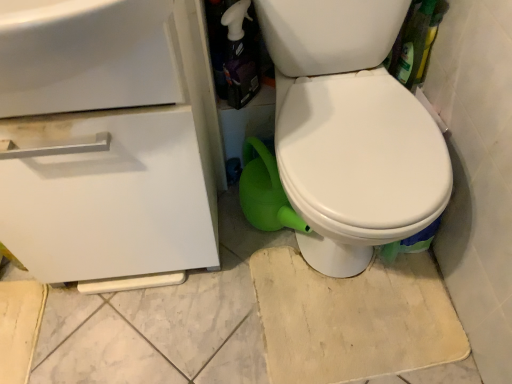
In order to click on white matte drawer at left in this screenshot , I will do `click(109, 194)`.

What do you see at coordinates (85, 56) in the screenshot? This screenshot has height=384, width=512. I see `white glossy sink at upper left` at bounding box center [85, 56].

Find the location of a particular element. The height and width of the screenshot is (384, 512). white glossy spray bottle at upper center is located at coordinates (240, 56).

Is white matte drawer at left located outside white glossy spray bottle at upper center?

white matte drawer at left lies outside white glossy spray bottle at upper center's area.

Considering the positions of points (131, 133) and (231, 39), is point (131, 133) closer to camera compared to point (231, 39)?

Yes.

Locate an element on the screen. drawer located on the left of white glossy spray bottle at upper center is located at coordinates (109, 194).

Looking at this image, is white matte drawer at left touching white glossy spray bottle at upper center?

No, white matte drawer at left is not with white glossy spray bottle at upper center.

Could you tell me if white matte drawer at left is facing white glossy sink at upper left?

No, white matte drawer at left does not turn towards white glossy sink at upper left.

Is white matte drawer at left positioned far away from white glossy sink at upper left?

No, there isn't a large distance between white matte drawer at left and white glossy sink at upper left.

Is white matte drawer at left taller than white glossy sink at upper left?

Yes.

Based on the photo, is white glossy sink at upper left beside white glossy spray bottle at upper center?

No.

Can you confirm if white glossy sink at upper left is positioned to the left of white glossy spray bottle at upper center?

Yes.

Which object is further away from the camera, white glossy sink at upper left or white glossy spray bottle at upper center?

white glossy spray bottle at upper center.

From a real-world perspective, is white glossy sink at upper left physically above white glossy spray bottle at upper center?

Yes, from a real-world perspective, white glossy sink at upper left is above white glossy spray bottle at upper center.

Is point (59, 11) closer to viewer compared to point (71, 163)?

Yes, it is in front of point (71, 163).

You are a GUI agent. You are given a task and a screenshot of the screen. Output one action in this format:
    pyautogui.click(x=<x>, y=<y>)
    Task: Click on the drawer located underneath the white glossy sink at upper left (from a real-world perspective)
    
    Given the screenshot: What is the action you would take?
    pyautogui.click(x=109, y=194)

Is white glossy sink at upper left looking in the opposite direction of white matte drawer at left?

Yes, white matte drawer at left is at the back of white glossy sink at upper left.

Consider the image. From a real-world perspective, relative to white matte drawer at left, is white glossy sink at upper left vertically above or below?

From a real-world perspective, white glossy sink at upper left is physically above white matte drawer at left.

Which is in front, point (231, 35) or point (54, 110)?

The point (54, 110) is in front.

What's the angular difference between white glossy spray bottle at upper center and white glossy sink at upper left's facing directions?

They differ by 0.905 degrees in their facing directions.

The width and height of the screenshot is (512, 384). In order to click on sink below the white glossy spray bottle at upper center (from the image's perspective) in this screenshot , I will do `click(85, 56)`.

Are white glossy spray bottle at upper center and white matte drawer at left far apart?

No, white glossy spray bottle at upper center is not far from white matte drawer at left.

Is white glossy spray bottle at upper center closer to camera compared to white matte drawer at left?

That is False.

From the image's perspective, does white glossy spray bottle at upper center appear lower than white matte drawer at left?

No, from the image's perspective, white glossy spray bottle at upper center is not beneath white matte drawer at left.

From a real-world perspective, does white glossy spray bottle at upper center sit lower than white matte drawer at left?

No, from a real-world perspective, white glossy spray bottle at upper center is not below white matte drawer at left.

The image size is (512, 384). What are the coordinates of `drawer directly beneath the white glossy spray bottle at upper center (from a real-world perspective)` in the screenshot? It's located at (109, 194).

You are a GUI agent. You are given a task and a screenshot of the screen. Output one action in this format:
    pyautogui.click(x=<x>, y=<y>)
    Task: Click on the sink above the white matte drawer at left (from the image's perspective)
    This screenshot has height=384, width=512.
    Given the screenshot: What is the action you would take?
    pyautogui.click(x=85, y=56)

Based on their spatial positions, is white matte drawer at left or white glossy spray bottle at upper center further from white glossy sink at upper left?

Based on the image, white glossy spray bottle at upper center appears to be further to white glossy sink at upper left.

Considering their positions, is white glossy spray bottle at upper center positioned further to white matte drawer at left than white glossy sink at upper left?

white glossy spray bottle at upper center lies further to white matte drawer at left than the other object.

Which object lies further to the anchor point white matte drawer at left, white glossy sink at upper left or white glossy spray bottle at upper center?

Among the two, white glossy spray bottle at upper center is located further to white matte drawer at left.

Based on their spatial positions, is white glossy sink at upper left or white matte drawer at left closer to white glossy spray bottle at upper center?

white matte drawer at left.

Considering their positions, is white matte drawer at left positioned further to white glossy spray bottle at upper center than white glossy sink at upper left?

white glossy sink at upper left lies further to white glossy spray bottle at upper center than the other object.

From the image, which object appears to be farther from white glossy sink at upper left, white glossy spray bottle at upper center or white matte drawer at left?

white glossy spray bottle at upper center is positioned further to the anchor white glossy sink at upper left.

Where is `drawer between white glossy sink at upper left and white glossy spray bottle at upper center from front to back`? The image size is (512, 384). drawer between white glossy sink at upper left and white glossy spray bottle at upper center from front to back is located at coordinates (109, 194).